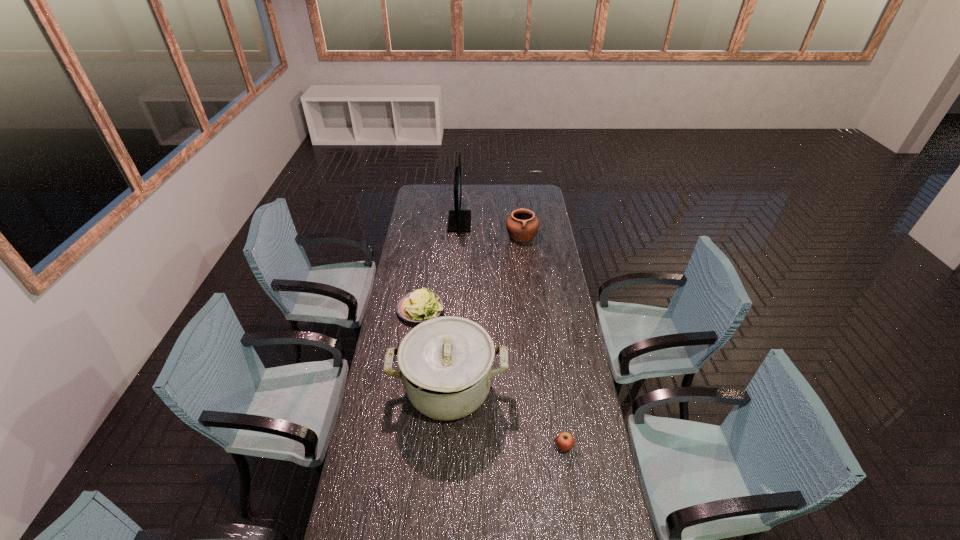
Image resolution: width=960 pixels, height=540 pixels. What are the coordinates of `monitor` in the screenshot? It's located at (459, 221).

Find the location of `the fourth shortest object`. the fourth shortest object is located at coordinates (446, 363).

Where is `saucepan`? Image resolution: width=960 pixels, height=540 pixels. saucepan is located at coordinates (446, 363).

In order to click on the third shortest object in this screenshot , I will do `click(522, 226)`.

I want to click on the third nearest object, so click(420, 305).

Find the location of `apple`. apple is located at coordinates (565, 441).

This screenshot has height=540, width=960. Find the location of `vacant region located on the screen side of the tallest object`. vacant region located on the screen side of the tallest object is located at coordinates (507, 221).

Locate an element on the screen. The image size is (960, 540). vacant region located 0.070m on the back of the second nearest object is located at coordinates (451, 341).

Image resolution: width=960 pixels, height=540 pixels. Identify the location of vacant space located 0.190m on the front of the pottery. (525, 267).

The height and width of the screenshot is (540, 960). What are the coordinates of `free space located on the right of the lettuce` in the screenshot? It's located at point(460,309).